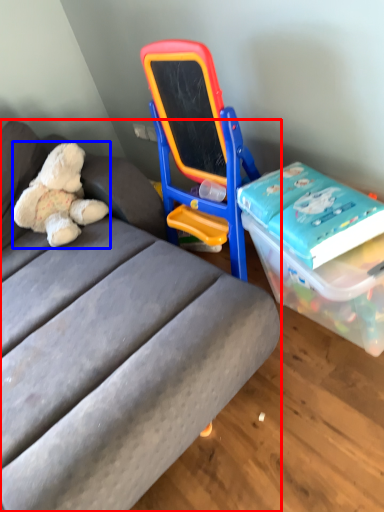
Question: Which of the following is the closest to the observer, studio couch (highlighted by a red box) or teddy bear (highlighted by a blue box)?

Choices:
 (A) studio couch
 (B) teddy bear

Answer: (A)